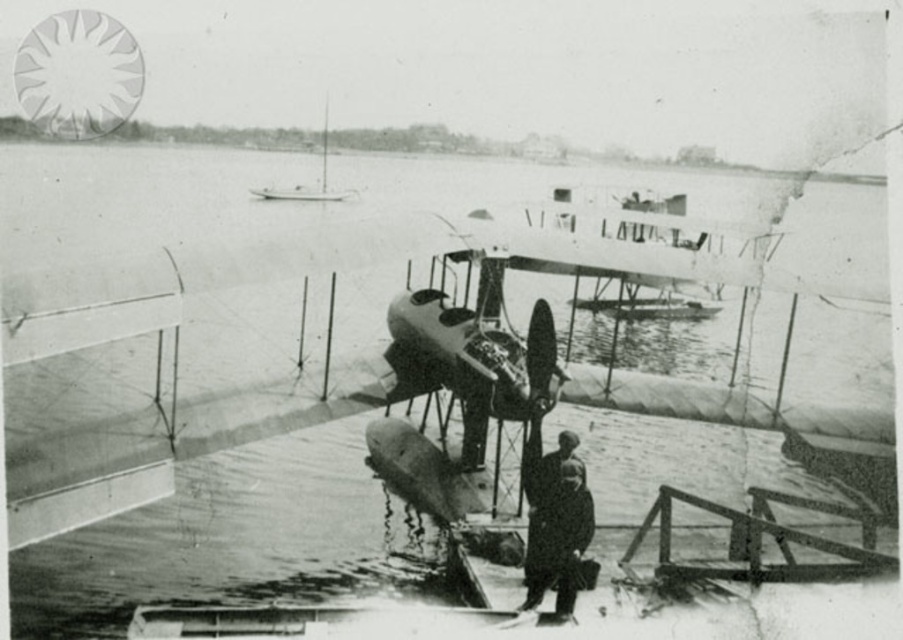
Question: Considering the relative positions of dark gray uniform at center and metallic silver biplane at upper center in the image provided, where is dark gray uniform at center located with respect to metallic silver biplane at upper center?

Choices:
 (A) below
 (B) above

Answer: (A)

Question: Can you confirm if dark gray uniform at center is positioned above metallic silver biplane at upper center?

Choices:
 (A) yes
 (B) no

Answer: (B)

Question: Is dark gray uniform at center smaller than metallic silver biplane at upper center?

Choices:
 (A) no
 (B) yes

Answer: (B)

Question: Which point appears closest to the camera in this image?

Choices:
 (A) (535, 493)
 (B) (284, 189)

Answer: (A)

Question: Which of the following is the farthest from the observer?

Choices:
 (A) (324, 116)
 (B) (559, 449)

Answer: (A)

Question: Which object appears farthest from the camera in this image?

Choices:
 (A) dark gray uniform at center
 (B) metallic silver biplane at upper center

Answer: (B)